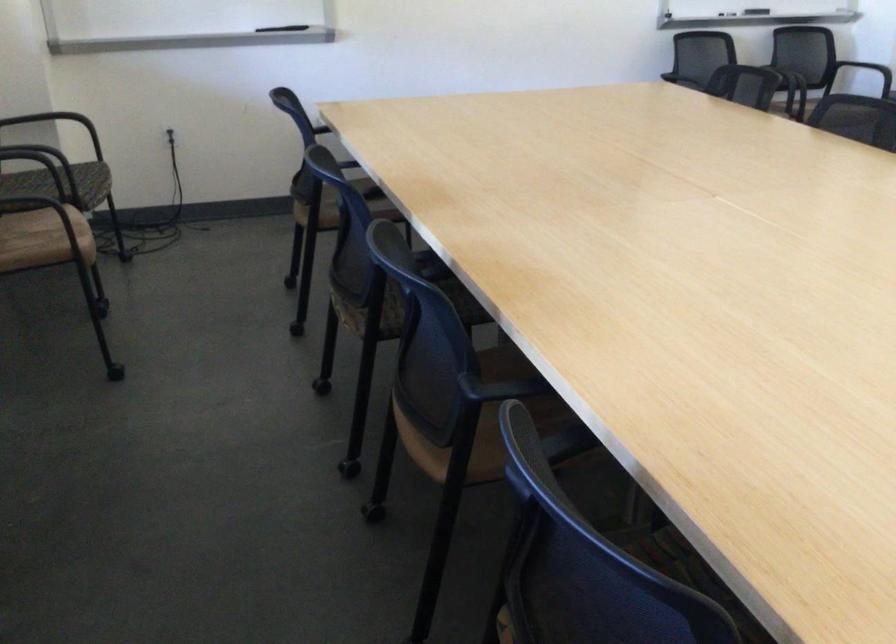
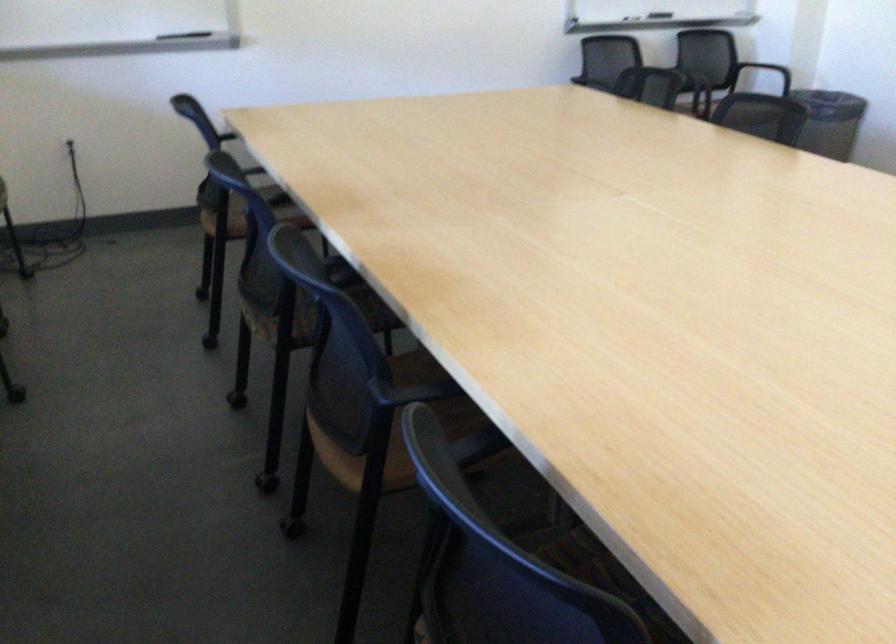
Find the pixel in the second image that matches (497,391) in the first image.

(409, 392)